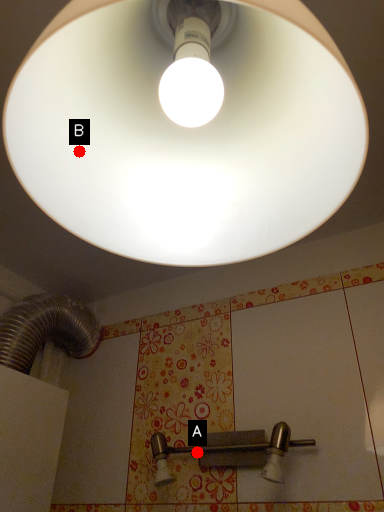
Question: Two points are circled on the image, labeled by A and B beside each circle. Which point is farther from the camera taking this photo?

Choices:
 (A) A is further
 (B) B is further

Answer: (A)